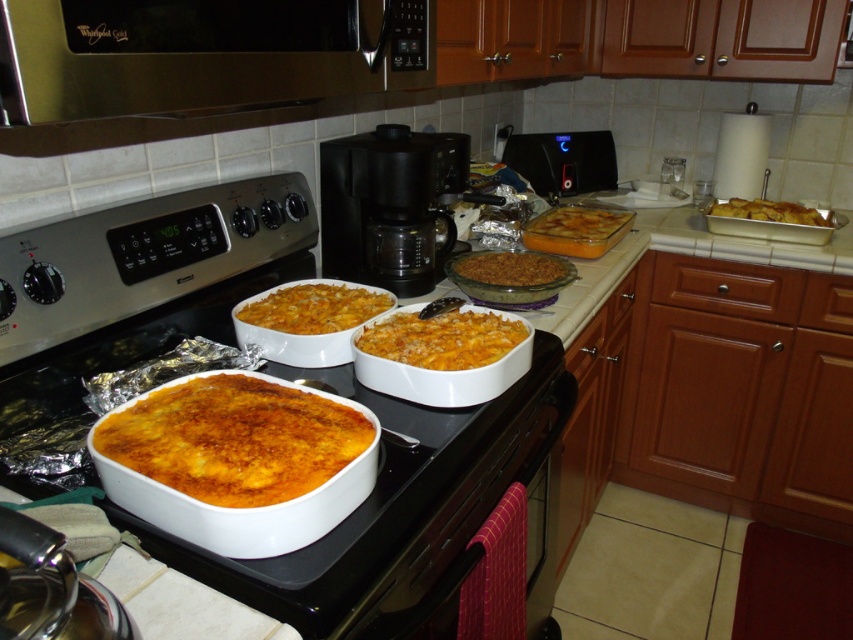
What is located at the coordinates point (x=390, y=205) in the kitchen scene?

The black plastic coffee maker at center is located at point (x=390, y=205).

Based on the photo, you are a chef preparing to place a new dish on the stovetop. You have a black plastic coffee maker at center and a golden brown baked pasta at center. Which item is taller?

The black plastic coffee maker at center is taller than the golden brown baked pasta at center.